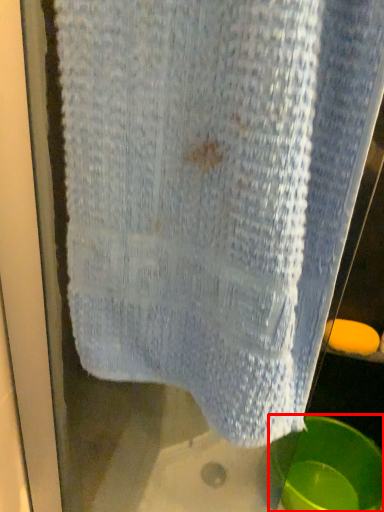
Question: From the image's perspective, where is basin (annotated by the red box) located in relation to soap in the image?

Choices:
 (A) above
 (B) below

Answer: (B)